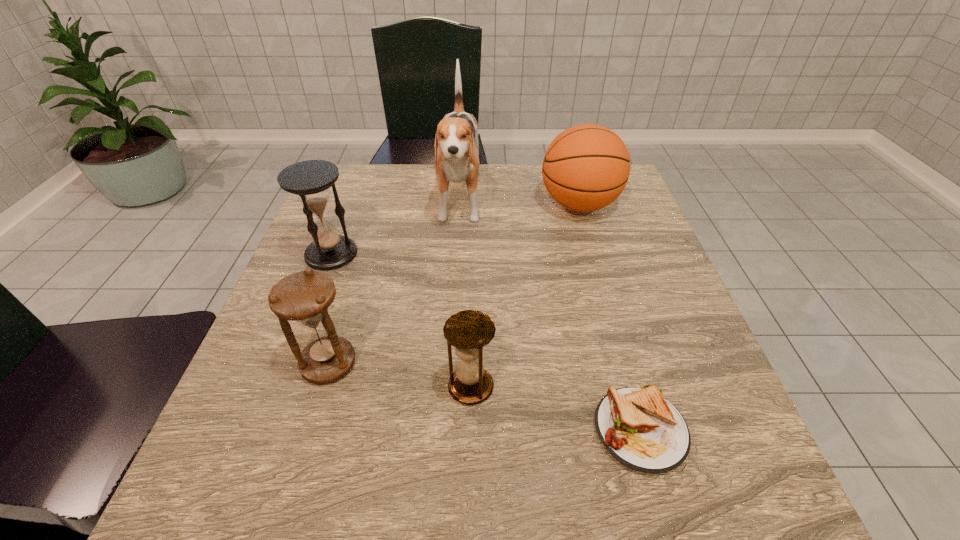
Identify the location of puppy. Image resolution: width=960 pixels, height=540 pixels. (456, 145).

Locate an element on the screen. Image resolution: width=960 pixels, height=540 pixels. basketball is located at coordinates (586, 167).

Locate an element on the screen. The height and width of the screenshot is (540, 960). the farthest hourglass is located at coordinates (310, 180).

Find the location of a particular element. the shortest hourglass is located at coordinates (469, 331).

The height and width of the screenshot is (540, 960). I want to click on the rightmost hourglass, so [x=469, y=331].

The image size is (960, 540). What are the coordinates of `the shortest object` in the screenshot? It's located at (642, 430).

Where is `free space located at the face of the puppy`? free space located at the face of the puppy is located at coordinates (455, 284).

Identify the location of vacant region located 0.280m on the left of the basketball. (430, 205).

At what (x,y) coordinates should I click in order to perform the action: click on free space located on the back of the farthest hourglass. Please return your answer as a coordinate pair (x, y). Looking at the image, I should click on (366, 164).

The width and height of the screenshot is (960, 540). Find the location of `free space located on the right of the shortest hourglass`. free space located on the right of the shortest hourglass is located at coordinates (577, 387).